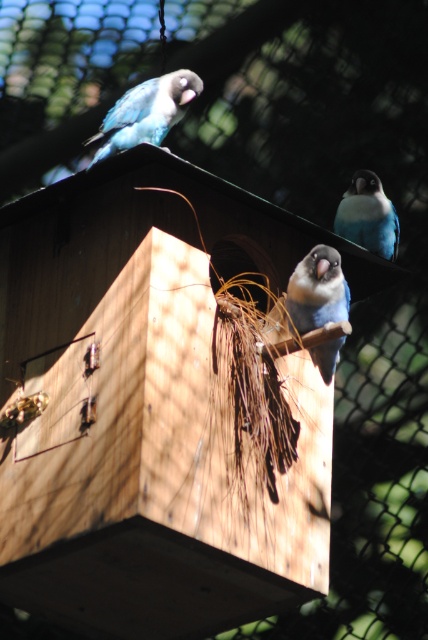
Question: Does blue matte parrot at center come in front of blue matte parrot at upper right?

Choices:
 (A) yes
 (B) no

Answer: (A)

Question: Which object is closer to the camera taking this photo?

Choices:
 (A) blue matte parrot at upper right
 (B) blue matte parrot at center
 (C) matte blue parrot at upper left

Answer: (B)

Question: Can you confirm if blue matte parrot at center is positioned to the right of blue matte parrot at upper right?

Choices:
 (A) yes
 (B) no

Answer: (B)

Question: Which point is closer to the camera?

Choices:
 (A) (314, 262)
 (B) (392, 243)
 (C) (128, 108)

Answer: (A)

Question: Which point is closer to the camera taking this photo?

Choices:
 (A) (148, 99)
 (B) (338, 268)
 (C) (341, 202)

Answer: (B)

Question: Does matte blue parrot at upper left appear on the left side of blue matte parrot at upper right?

Choices:
 (A) no
 (B) yes

Answer: (B)